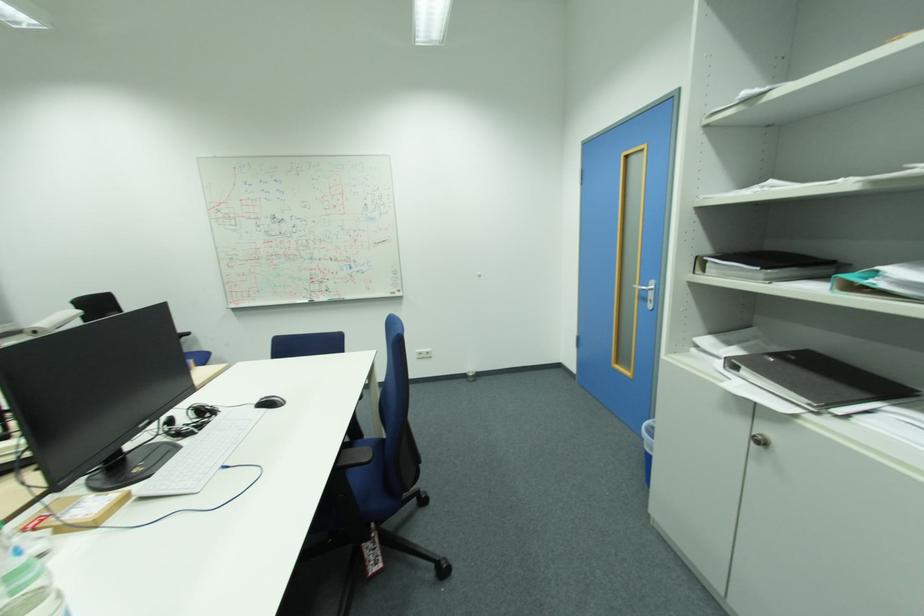
This screenshot has width=924, height=616. I want to click on silver door handle, so click(x=648, y=292).